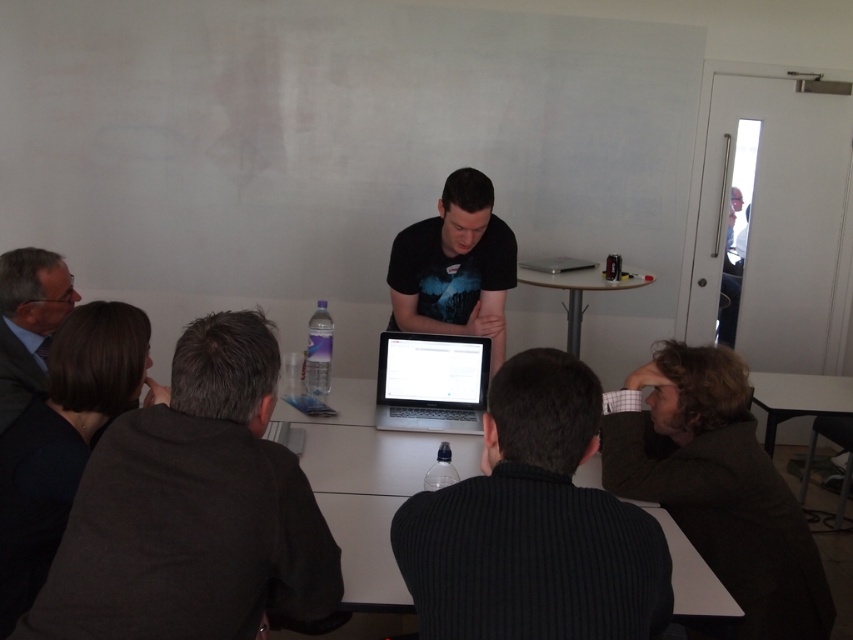
Locate an element on the screen. dark brown sweater at lower right is located at coordinates (717, 484).

Consider the image. Is dark brown sweater at lower right shorter than white glossy table at lower right?

In fact, dark brown sweater at lower right may be taller than white glossy table at lower right.

Is point (651, 406) closer to camera compared to point (848, 397)?

Yes, point (651, 406) is in front of point (848, 397).

Where is `dark brown sweater at lower right`? Image resolution: width=853 pixels, height=640 pixels. dark brown sweater at lower right is located at coordinates (717, 484).

Is dark gray ribbed sweater at center to the right of silver metallic laptop at center from the viewer's perspective?

Incorrect, dark gray ribbed sweater at center is not on the right side of silver metallic laptop at center.

Which is behind, point (579, 637) or point (560, 269)?

Point (560, 269)

Which is in front, point (585, 403) or point (564, 272)?

Positioned in front is point (585, 403).

Identify the location of dark gray ribbed sweater at center. The width and height of the screenshot is (853, 640). (532, 525).

Can you confirm if satin black laptop at center is thinner than white glossy table at center?

Yes, satin black laptop at center is thinner than white glossy table at center.

Which is in front, point (459, 337) or point (567, 314)?

Point (459, 337) is more forward.

This screenshot has width=853, height=640. I want to click on satin black laptop at center, so click(x=431, y=381).